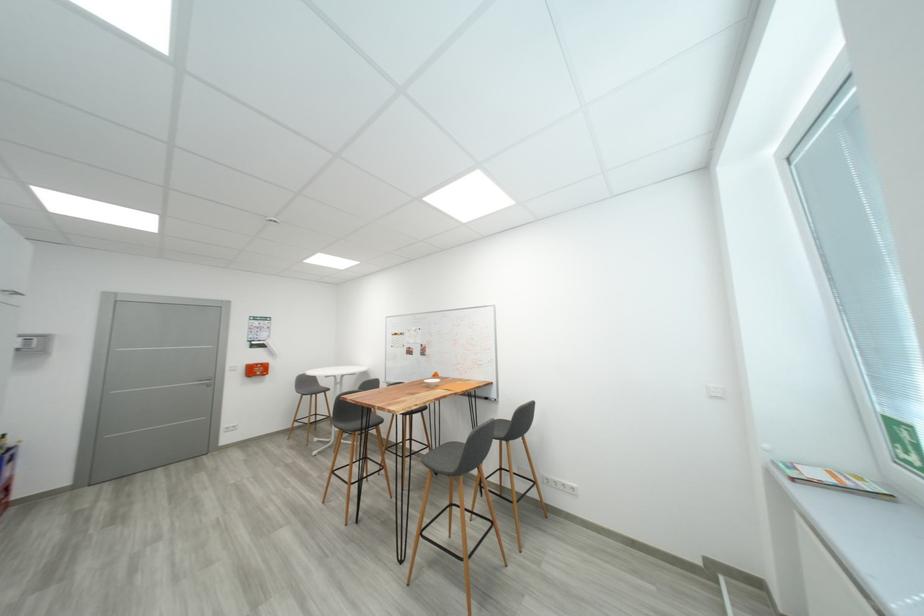
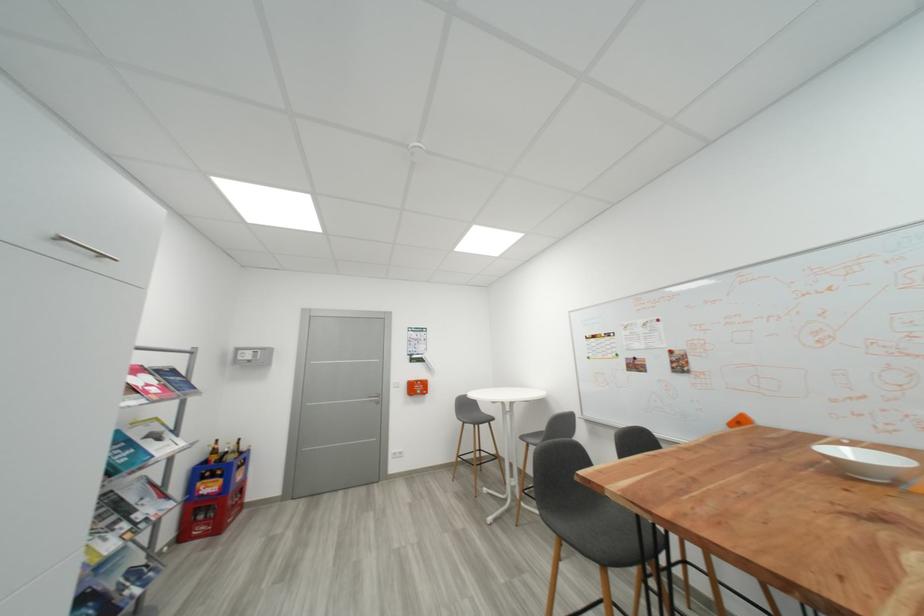
In the second image, find the point that corresponds to [215,387] in the first image.

(383, 405)